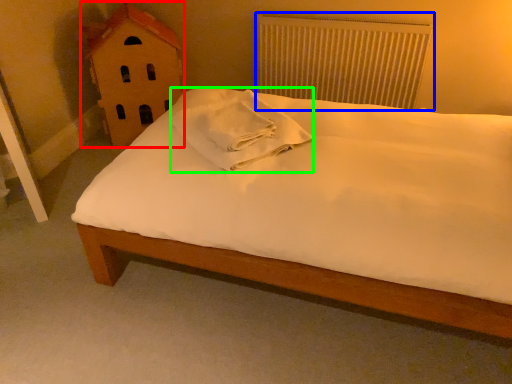
Question: Estimate the real-world distances between objects in this image. Which object is closer to toy (highlighted by a red box), radiator (highlighted by a blue box) or material (highlighted by a green box)?

Choices:
 (A) radiator
 (B) material

Answer: (B)